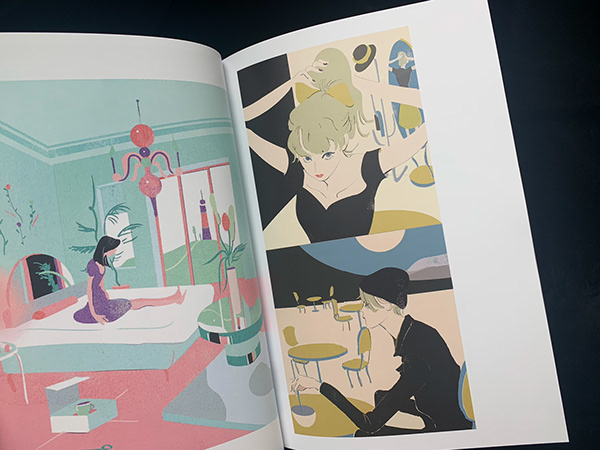
The height and width of the screenshot is (450, 600). Find the location of `coat rack`. coat rack is located at coordinates click(375, 65).